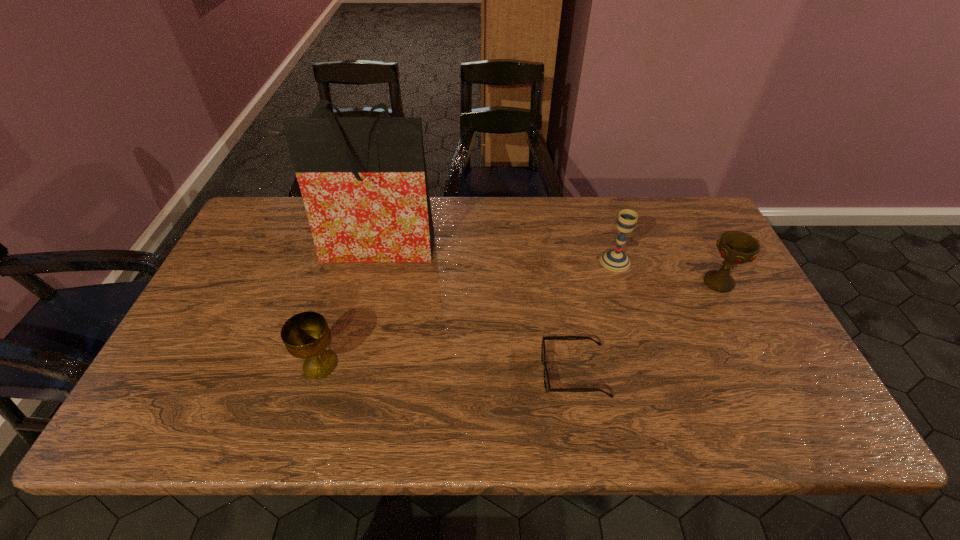
The image size is (960, 540). In the image, there is a desktop. In order to click on vacant space at the near left corner in this screenshot , I will do `click(215, 400)`.

You are a GUI agent. You are given a task and a screenshot of the screen. Output one action in this format:
    pyautogui.click(x=<x>, y=<y>)
    Task: Click on the free space between the nearest chalice and the rightmost chalice
    This screenshot has width=960, height=540.
    Given the screenshot: What is the action you would take?
    pyautogui.click(x=519, y=324)

The image size is (960, 540). What are the coordinates of `free space between the third object from left to right and the rightmost chalice` in the screenshot? It's located at pyautogui.click(x=647, y=328).

This screenshot has height=540, width=960. Find the location of `free spot between the third object from right to left and the fourth object from left to right`. free spot between the third object from right to left and the fourth object from left to right is located at coordinates (594, 317).

At what (x,y) coordinates should I click in order to perform the action: click on free spot between the shopping bag and the third object from left to right. Please return your answer as a coordinate pair (x, y). Looking at the image, I should click on (473, 309).

Identify the location of vacant area between the third object from left to right and the rightmost object. (647, 328).

Identify the location of vacant point located between the second chalice from left to right and the rightmost object. Image resolution: width=960 pixels, height=540 pixels. (667, 272).

You are a GUI agent. You are given a task and a screenshot of the screen. Output one action in this format:
    pyautogui.click(x=<x>, y=<y>)
    Task: Click on the blank region between the rightmost object and the tallest object
    
    Given the screenshot: What is the action you would take?
    pyautogui.click(x=545, y=265)

You are a GUI agent. You are given a task and a screenshot of the screen. Output one action in this format:
    pyautogui.click(x=<x>, y=<y>)
    Task: Click on the vacant space that is in between the second chalice from right to left and the third object from left to right
    The image size is (960, 540).
    Given the screenshot: What is the action you would take?
    pyautogui.click(x=594, y=317)

Find the location of a particular element. free spot between the fourth object from left to right and the leftmost chalice is located at coordinates (468, 313).